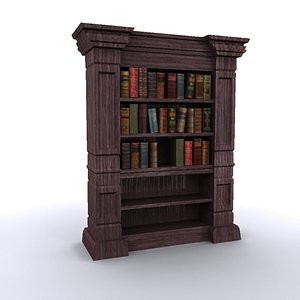
Identify the location of books on fourth shelf. Image resolution: width=300 pixels, height=300 pixels. (128, 120), (133, 119), (144, 117), (151, 117), (165, 116), (172, 117), (181, 116), (189, 118), (200, 119), (206, 120).